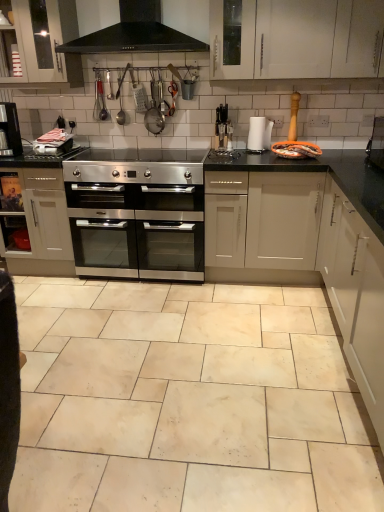
Find the location of a particular element. The width and height of the screenshot is (384, 512). empty space that is ontop of white paper towel at center, positioned as the first appliance in right-to-left order (from a real-world perspective) is located at coordinates (258, 116).